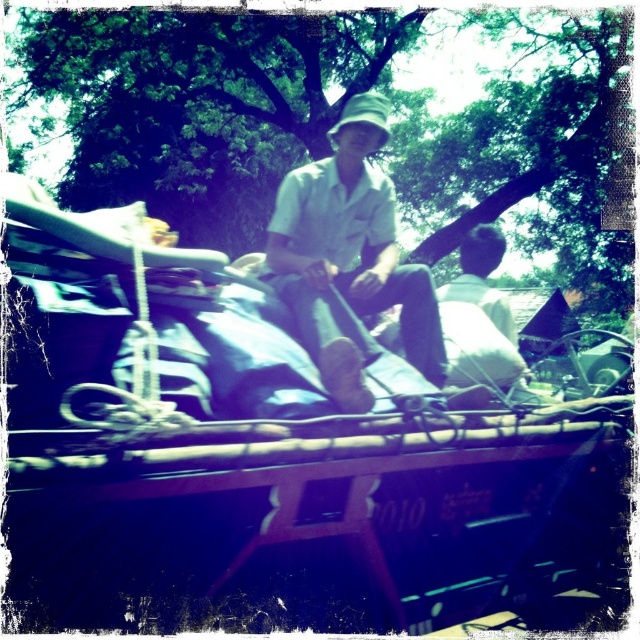
Is wooden boat at center to the right of white matte shirt at center from the viewer's perspective?

Yes, wooden boat at center is to the right of white matte shirt at center.

Is point (387, 484) positioned after point (385, 240)?

No, (387, 484) is in front of (385, 240).

Is point (202, 512) positioned behind point (365, 96)?

No, (202, 512) is closer to viewer.

The height and width of the screenshot is (640, 640). I want to click on wooden boat at center, so pos(266,448).